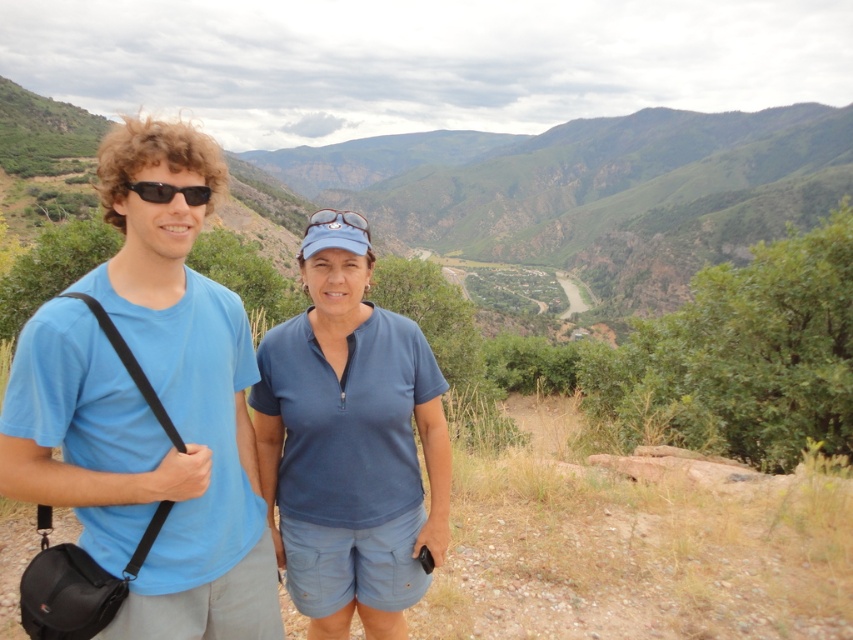
You are a photographer trying to capture a candid shot of the two people in the mountain scene. You notice the blue cotton shirt at center and the blue matte sunglasses at center. Which object should you focus on if you want to capture the subject that is positioned to the right of the other?

The blue cotton shirt at center is to the right of the blue matte sunglasses at center, so you should focus on the blue cotton shirt at center to capture the subject positioned to the right.

You are a photographer trying to capture a photo of both the sunglasses at left and the blue matte sunglasses at center in the same frame. The camera you are using has a maximum focus range of 5 meters. Will you be able to capture both objects in focus simultaneously?

The sunglasses at left is 5.59 meters from blue matte sunglasses at center. Since the distance between them exceeds the camera maximum focus range of 5 meters, you will not be able to capture both objects in focus simultaneously.